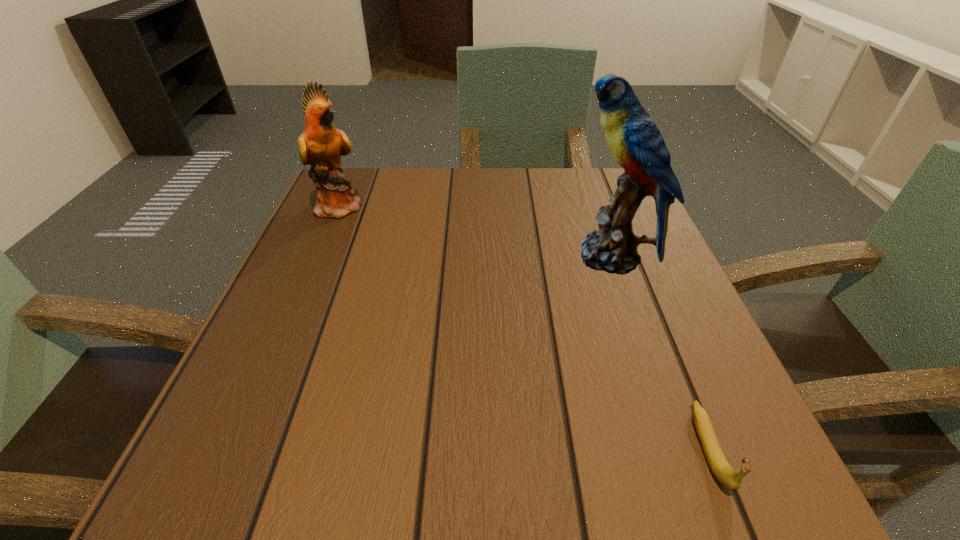
Locate an element on the screen. The image size is (960, 540). object positioned at the far edge is located at coordinates (321, 145).

You are a GUI agent. You are given a task and a screenshot of the screen. Output one action in this format:
    pyautogui.click(x=<x>, y=<y>)
    Task: Click on the object present at the near edge
    
    Given the screenshot: What is the action you would take?
    pyautogui.click(x=720, y=467)

Where is `object located at the left edge`? object located at the left edge is located at coordinates (321, 145).

Where is `parrot that is at the right edge`? parrot that is at the right edge is located at coordinates (636, 143).

You are a GUI agent. You are given a task and a screenshot of the screen. Output one action in this format:
    pyautogui.click(x=<x>, y=<y>)
    Task: Click on the banana present at the right edge
    
    Given the screenshot: What is the action you would take?
    pyautogui.click(x=720, y=467)

The image size is (960, 540). What are the coordinates of `object at the far left corner` in the screenshot? It's located at (321, 145).

Identify the location of object that is positioned at the near right corner. The width and height of the screenshot is (960, 540). (720, 467).

I want to click on free space at the far edge of the desktop, so click(425, 170).

The image size is (960, 540). Identify the location of vacant space at the near edge. (531, 450).

In the image, there is a desktop. Where is `free space at the left edge`? The height and width of the screenshot is (540, 960). free space at the left edge is located at coordinates (293, 404).